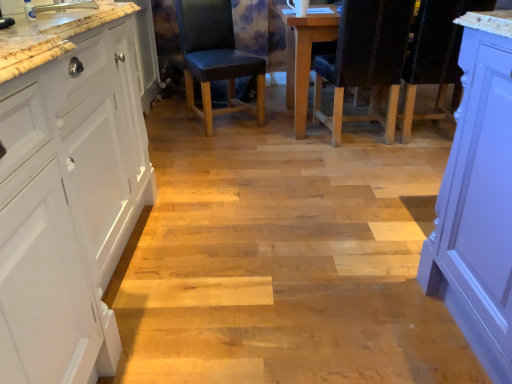
The width and height of the screenshot is (512, 384). What are the coordinates of `vacant space in front of leather-like black chair at center, arranged as the 1th chair when viewed from the left` in the screenshot? It's located at (231, 144).